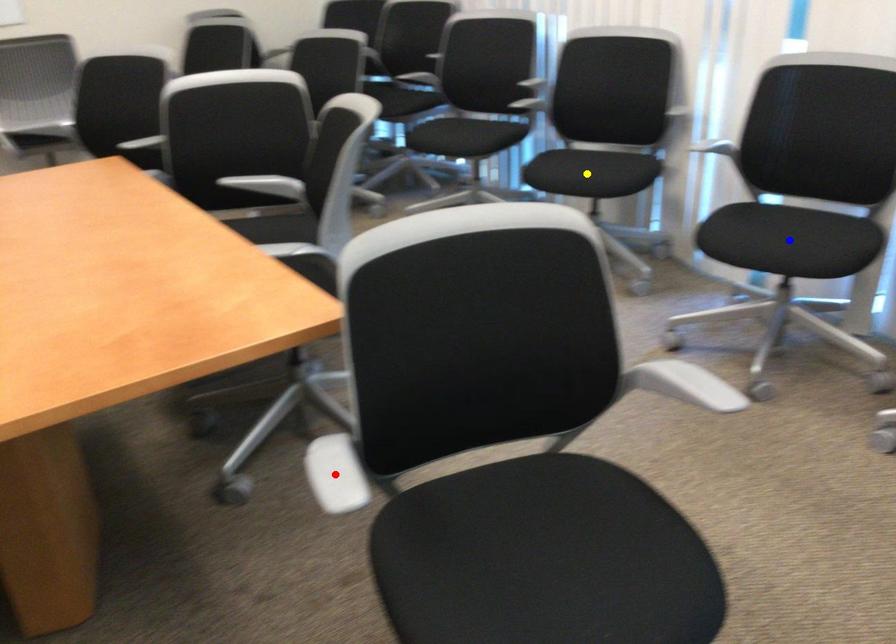
Order these from nearest to farthest:
blue point
yellow point
red point

red point
blue point
yellow point